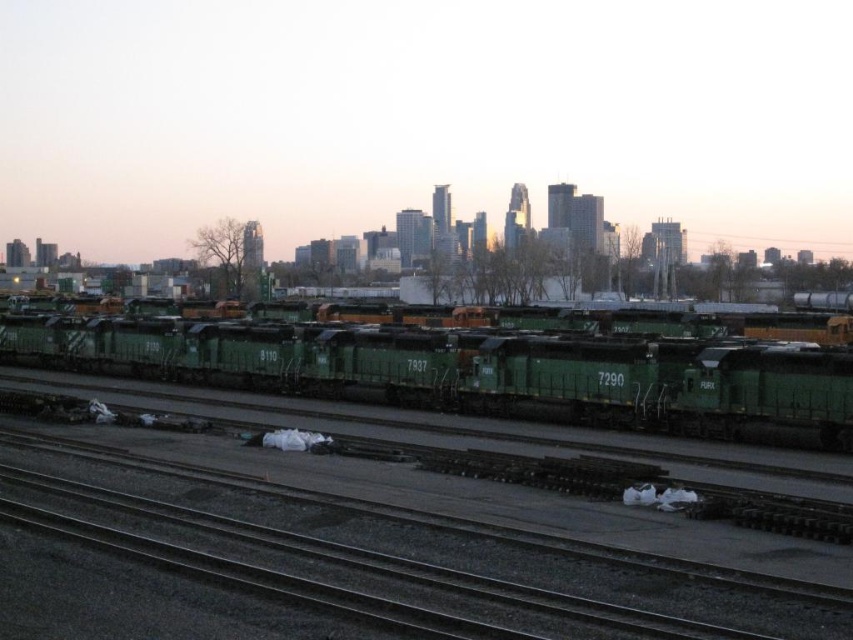
Question: Does black asphalt train track at lower center have a smaller size compared to green matte train at center?

Choices:
 (A) no
 (B) yes

Answer: (B)

Question: Does black asphalt train track at lower center appear on the right side of green matte train at center?

Choices:
 (A) no
 (B) yes

Answer: (B)

Question: Can you confirm if black asphalt train track at lower center is positioned to the right of green matte train at center?

Choices:
 (A) no
 (B) yes

Answer: (B)

Question: Which of the following is the farthest from the observer?

Choices:
 (A) green matte train at center
 (B) black asphalt train track at lower center

Answer: (A)

Question: Which point is farther to the camera?

Choices:
 (A) (318, 364)
 (B) (828, 628)

Answer: (A)